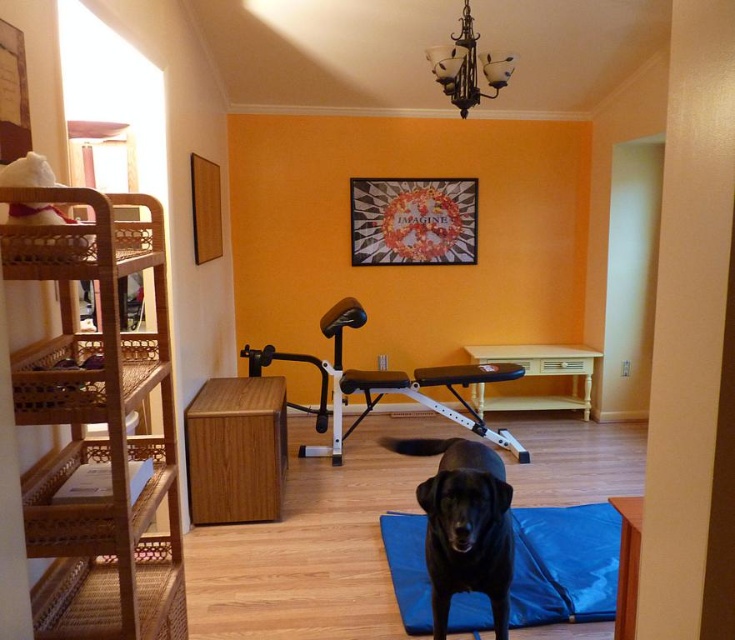
You are setting up a home gym in the room with a wooden bunk bed at center and a blue fabric yoga mat at center. Since both are at the center, how can you arrange them so they don

The blue fabric yoga mat at center has a lesser height compared to wooden bunk bed at center, so you can place the yoga mat underneath the wooden bunk bed at center to utilize vertical space effectively.

You are setting up a yoga space in this room. You need to place the blue fabric yoga mat at center so that it doesn not block the path to the woven wood bunk bed at left. Given their widths, is this possible?

The woven wood bunk bed at left has a lesser width compared to blue fabric yoga mat at center. Therefore, placing the blue fabric yoga mat at center without blocking the path is possible as the mat is wider and can be positioned to allow passage to the narrower bunk bed.

You are a person entering the room and want to place a new red cushion on the blue fabric yoga mat at center. However, there is a black matte dog at center currently occupying the space. Can you place the cushion there without moving the dog?

The blue fabric yoga mat at center is below the black matte dog at center, so the dog is currently standing on the mat. To place the cushion there, you would need to move the dog first.